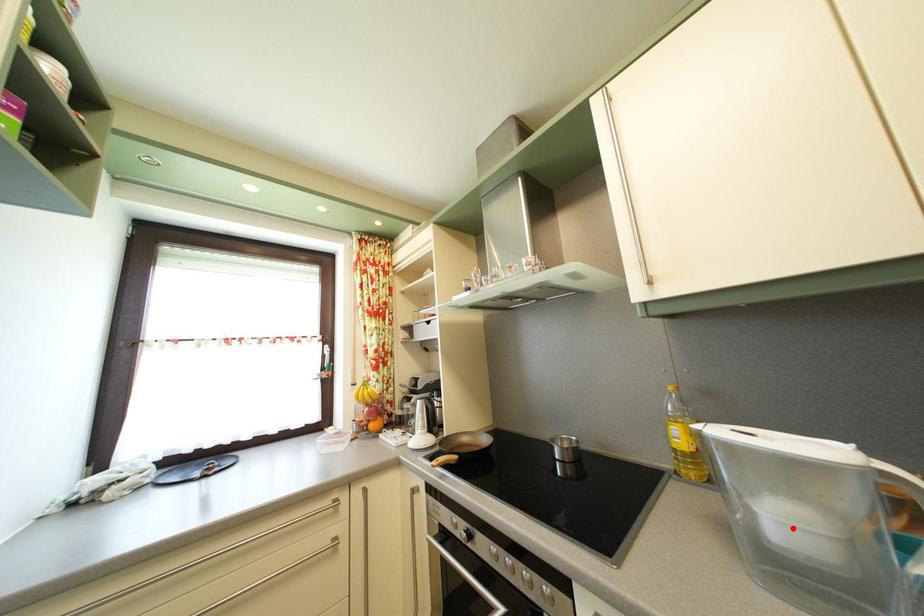
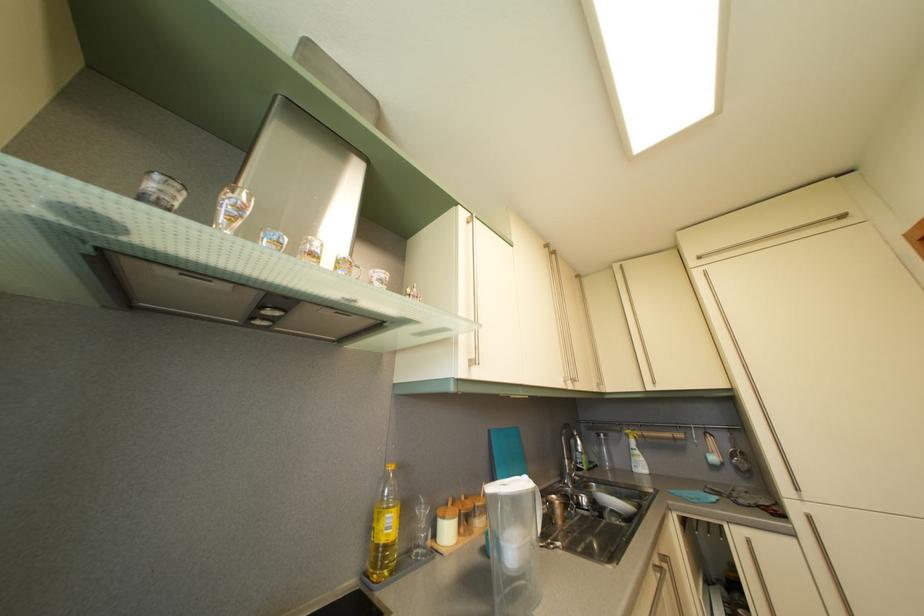
The point at the highlighted location is marked in the first image. Where is the corresponding point in the second image?

(521, 554)